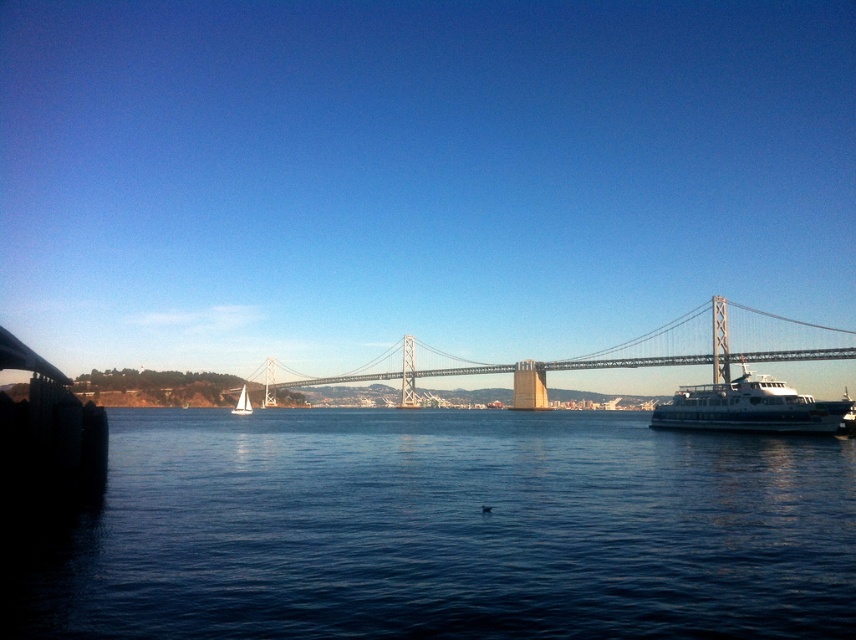
Does blue water at lower center appear on the right side of white glossy cruise ship at right?

In fact, blue water at lower center is to the left of white glossy cruise ship at right.

Can you confirm if blue water at lower center is bigger than white glossy cruise ship at right?

No, blue water at lower center is not bigger than white glossy cruise ship at right.

Find the location of a particular element. blue water at lower center is located at coordinates (444, 531).

Can you confirm if metallic gray suspension bridge at center is bigger than white sailboat at left?

Correct, metallic gray suspension bridge at center is larger in size than white sailboat at left.

What are the coordinates of `metallic gray suspension bridge at center` in the screenshot? It's located at [694, 353].

This screenshot has width=856, height=640. What do you see at coordinates (694, 353) in the screenshot? I see `metallic gray suspension bridge at center` at bounding box center [694, 353].

Who is more forward, (637, 340) or (823, 410)?

Point (823, 410) is in front.

Does point (720, 355) lie behind point (714, 422)?

Yes, point (720, 355) is farther from viewer.

This screenshot has height=640, width=856. What are the coordinates of `metallic gray suspension bridge at center` in the screenshot? It's located at (694, 353).